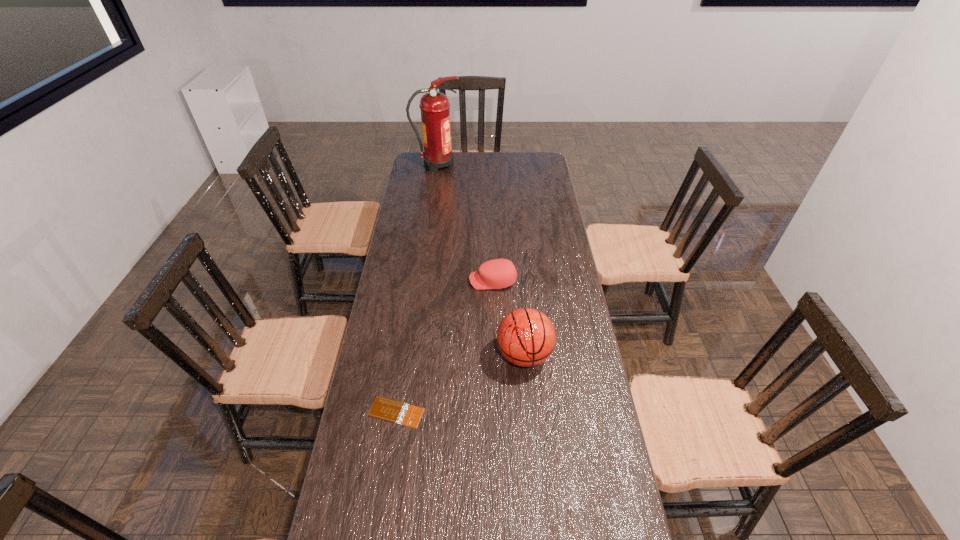
You are a GUI agent. You are given a task and a screenshot of the screen. Output one action in this format:
    pyautogui.click(x=<x>, y=<y>)
    Task: Click on the free spot at the left edge of the desktop
    The height and width of the screenshot is (540, 960).
    Given the screenshot: What is the action you would take?
    pyautogui.click(x=352, y=484)

Find the location of a particular element. The image size is (960, 540). vacant area at the right edge of the desktop is located at coordinates (530, 187).

I want to click on vacant space at the far left corner of the desktop, so click(x=412, y=172).

Locate an element on the screen. free space between the chocolate bar and the second farthest object is located at coordinates (444, 346).

The height and width of the screenshot is (540, 960). In order to click on vacant area that lies between the second nearest object and the farthest object in this screenshot , I will do `click(481, 260)`.

Where is `free spot between the third farthest object and the nearest object`? The height and width of the screenshot is (540, 960). free spot between the third farthest object and the nearest object is located at coordinates (461, 383).

The image size is (960, 540). I want to click on empty location between the farthest object and the nearest object, so click(x=417, y=288).

Where is `vacant point located between the cap and the fire extinguisher`? This screenshot has width=960, height=540. vacant point located between the cap and the fire extinguisher is located at coordinates (465, 223).

This screenshot has height=540, width=960. I want to click on unoccupied area between the tallest object and the nearest object, so click(417, 288).

At what (x,y) coordinates should I click in order to perform the action: click on free space between the third farthest object and the nearest object. Please return your answer as a coordinate pair (x, y). The image size is (960, 540). Looking at the image, I should click on tap(461, 383).